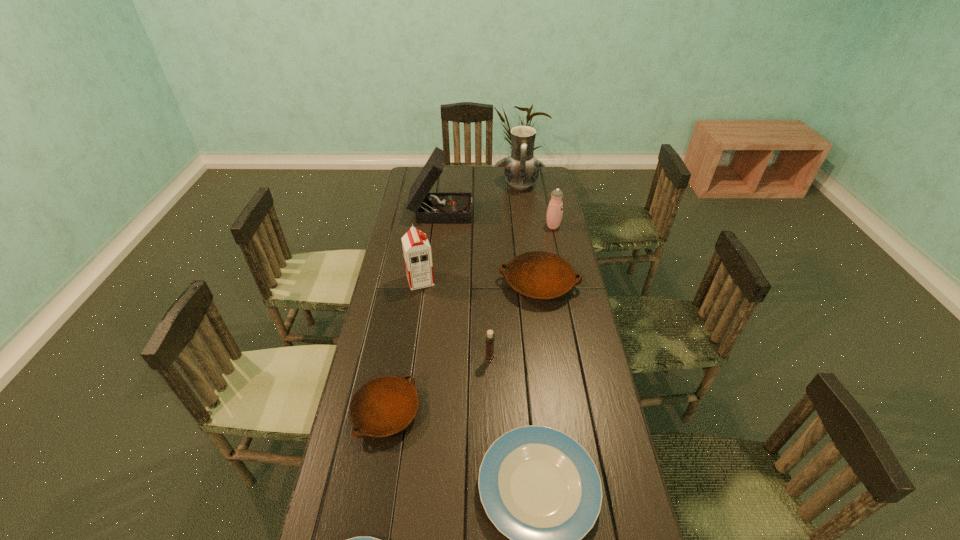
You are a GUI agent. You are given a task and a screenshot of the screen. Output one action in this format:
    pyautogui.click(x=<x>, y=<y>)
    Task: Click on the second closest plate to the shortest plate
    The image size is (960, 540).
    Given the screenshot: What is the action you would take?
    point(383,406)

Find the location of a particular element. The height and width of the screenshot is (540, 960). vacant space that satisfies the following two spatial constraints: 1. on the front-facing side of the phonograph_record; 2. on the left side of the thermos bottle is located at coordinates (440, 227).

The width and height of the screenshot is (960, 540). What are the coordinates of `free spot that satisfies the following two spatial constraints: 1. on the back side of the farthest plate; 2. on the left side of the left brown plate` in the screenshot? It's located at (409, 284).

What are the coordinates of `free space in the image that satisfies the following two spatial constraints: 1. on the front-facing side of the phonograph_record; 2. on the front side of the third shortest plate` in the screenshot? It's located at [418, 413].

Where is `vacant space that satisfies the following two spatial constraints: 1. on the back side of the right brown plate; 2. on the front-facing side of the pitcher`? vacant space that satisfies the following two spatial constraints: 1. on the back side of the right brown plate; 2. on the front-facing side of the pitcher is located at coordinates (524, 185).

The width and height of the screenshot is (960, 540). I want to click on vacant space that satisfies the following two spatial constraints: 1. on the back side of the thermos bottle; 2. on the left side of the soya milk, so click(428, 227).

In order to click on free point that satisfies the following two spatial constraints: 1. on the front-facing side of the phonograph_record; 2. on the right side of the tallest plate in this screenshot , I will do `click(433, 284)`.